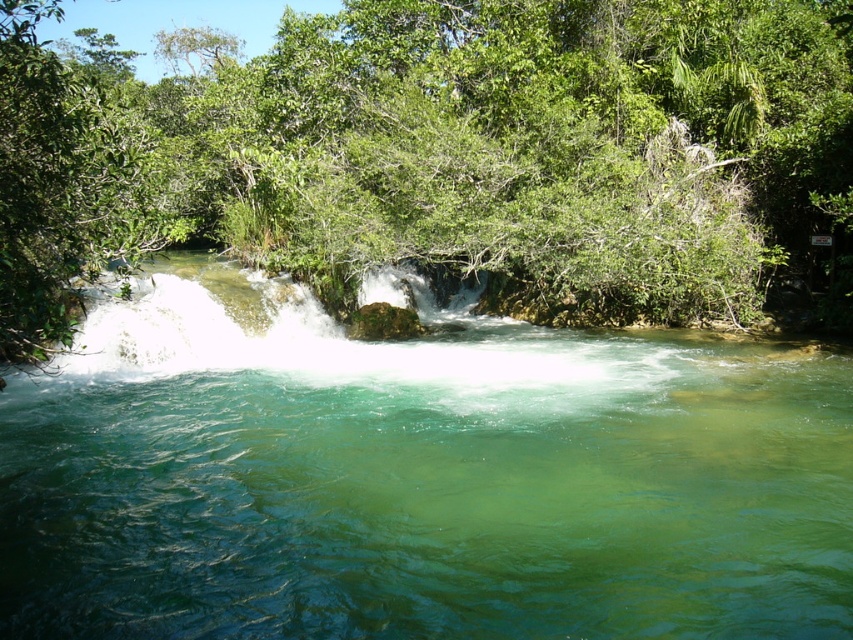
You are a hiker standing at the edge of the river. You notice the clear water at center and the green leafy tree at upper center. Which object is closer to the ground?

The clear water at center is closer to the ground than the green leafy tree at upper center because it is shorter than the tree.

You are standing at the edge of the river and see the clear water at center and the green leafy tree at upper center. Which object is closer to you?

The clear water at center is closer to you because it is in front of the green leafy tree at upper center.

You are a hiker who wants to cross the river using a fallen tree trunk. You notice the clear water at center and the green leafy tree at upper center. Which object is directly above the other, and why?

The green leafy tree at upper center is directly above the clear water at center because the description states that the clear water at center is positioned under the green leafy tree at upper center.